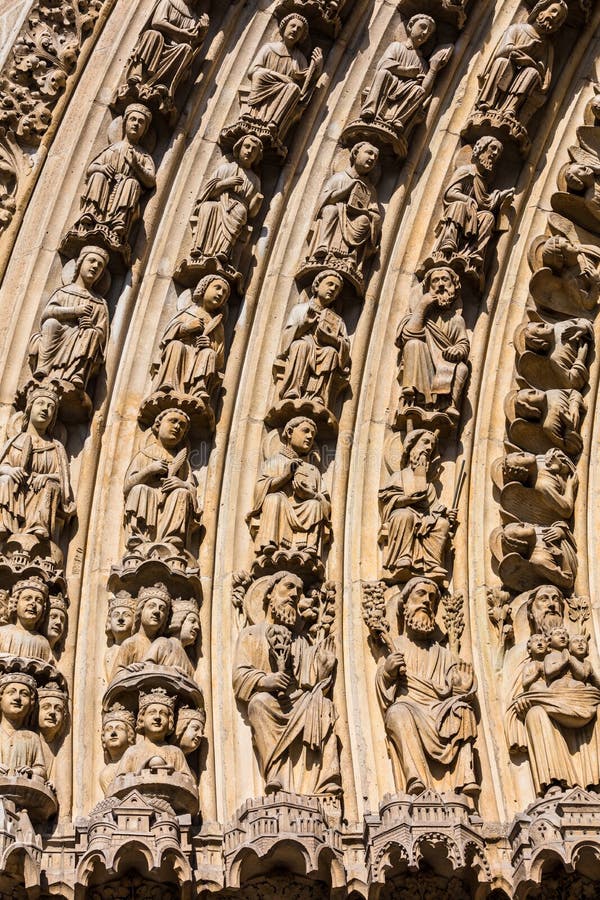
The width and height of the screenshot is (600, 900). In order to click on archway in this screenshot , I will do click(x=501, y=360), click(x=384, y=322), click(x=277, y=299), click(x=160, y=267), click(x=38, y=222), click(x=9, y=51).